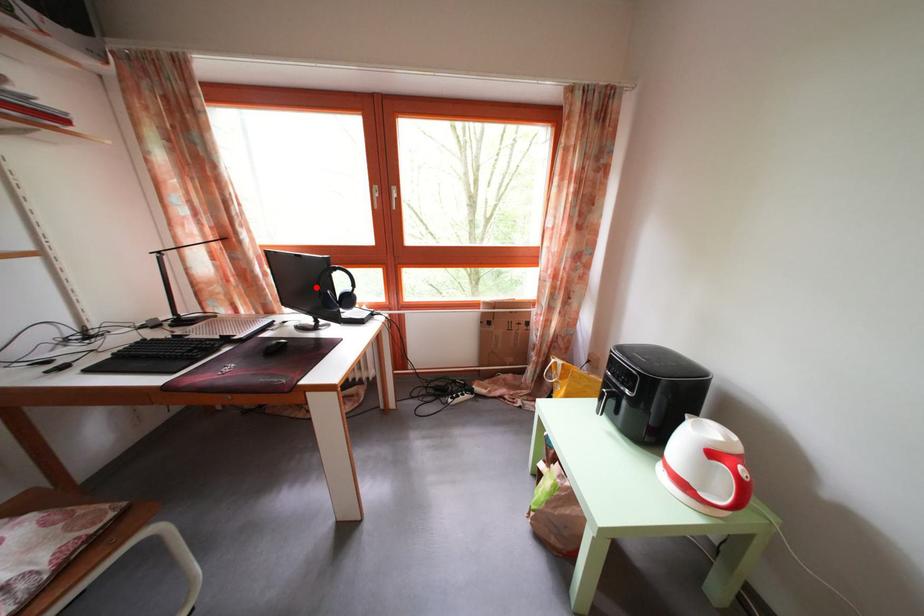
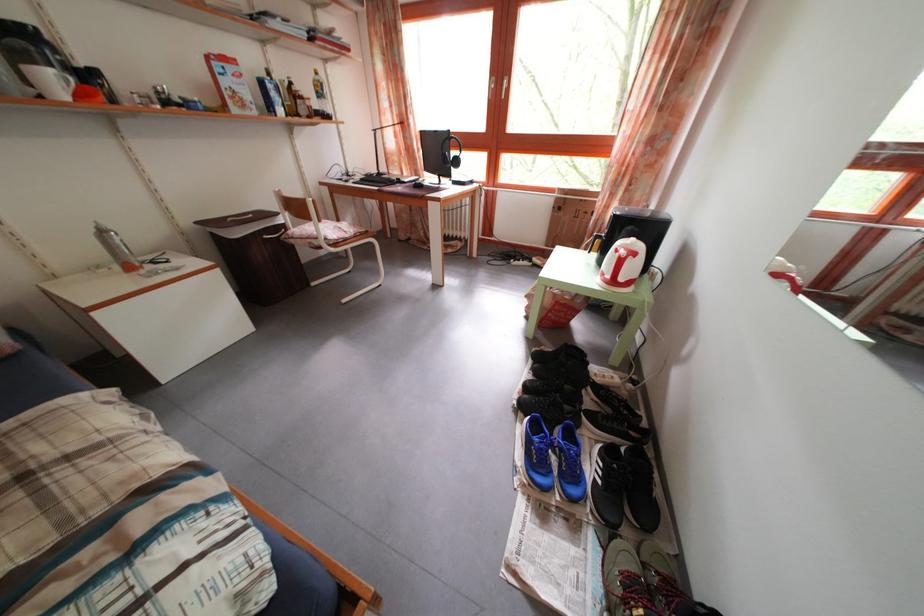
Find the pixel in the second image that matches the highlighted location in the first image.

(446, 160)